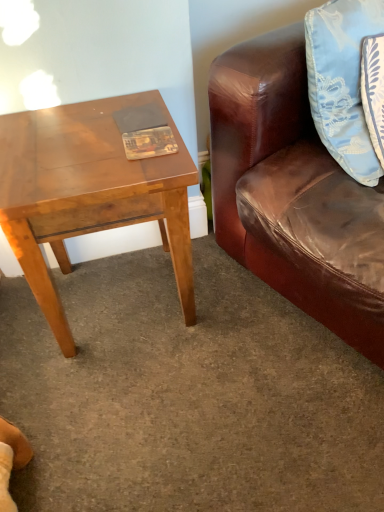
The height and width of the screenshot is (512, 384). What are the coordinates of `free space to the right of light brown wooden table at left` in the screenshot? It's located at [x=247, y=313].